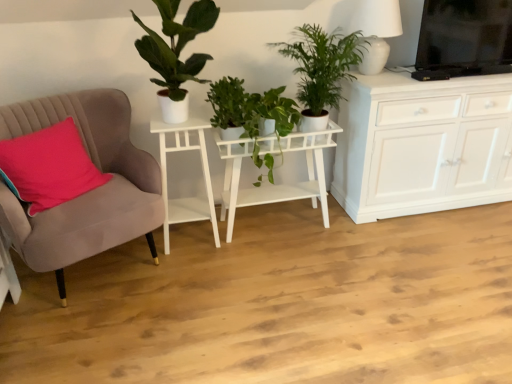
In order to click on free location to the right of white matte plant stand at center, the 2th table from the left in this screenshot , I will do `click(358, 238)`.